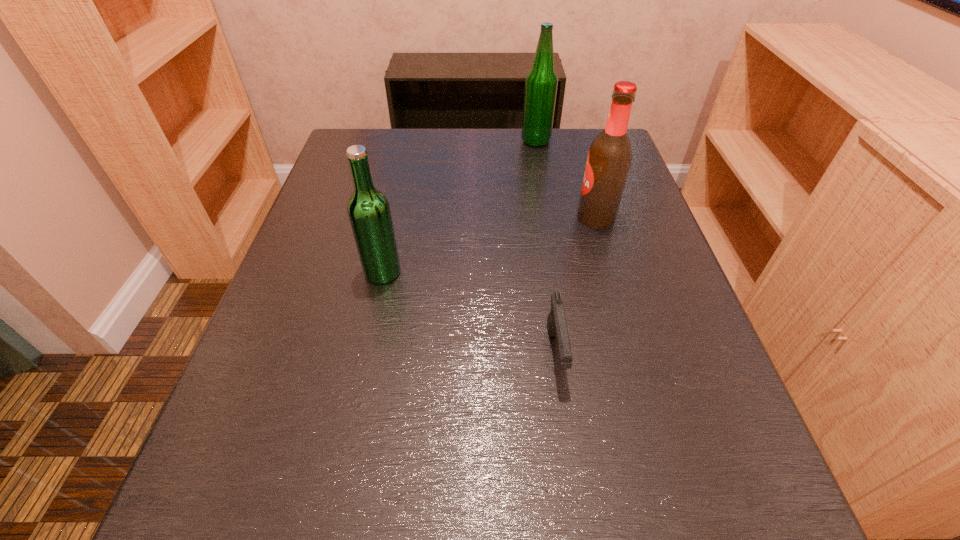
Identify the location of vacant space that is in between the nearest object and the leftmost object. (469, 313).

Locate an element on the screen. vacant point located between the rightmost object and the farthest beer bottle is located at coordinates (565, 179).

The width and height of the screenshot is (960, 540). Identify the location of the second closest object relative to the farthest object. (369, 212).

Locate an element on the screen. object that is the third closest to the farthest beer bottle is located at coordinates (556, 322).

Image resolution: width=960 pixels, height=540 pixels. Identify the location of the second closest beer bottle relative to the farthest beer bottle. (369, 212).

Where is `the second closest beer bottle to the second farthest object`? the second closest beer bottle to the second farthest object is located at coordinates (369, 212).

Locate an element on the screen. The height and width of the screenshot is (540, 960). free space that satisfies the following two spatial constraints: 1. on the label of the farthest object; 2. on the back side of the third nearest object is located at coordinates (549, 218).